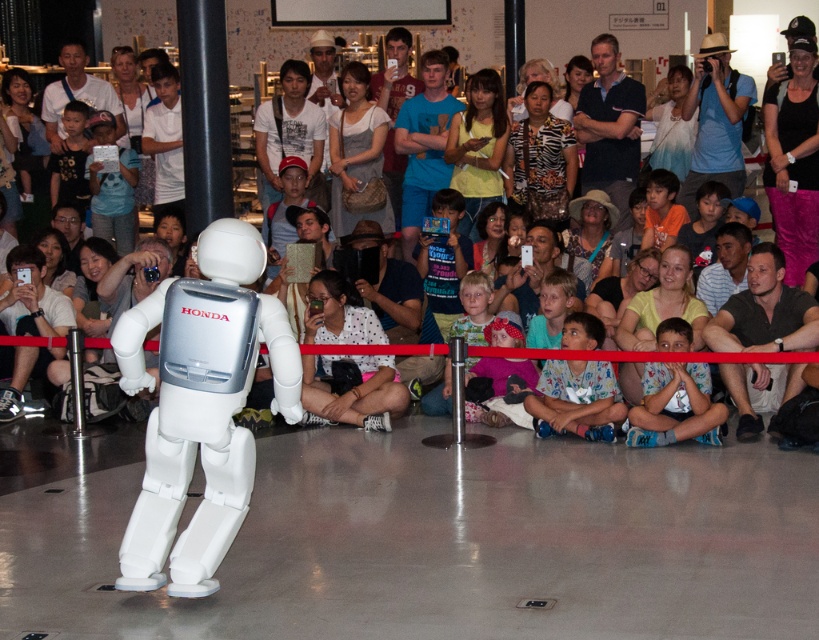
You are a photographer at the event and want to capture both the pink fabric at upper right and the white fabric hat at center in the same frame. Which object should you position closer to the edge of your camera viewfinder to include both?

To include both the pink fabric at upper right and the white fabric hat at center in the same frame, position the pink fabric at upper right closer to the edge of your camera viewfinder since it is located to the right of the white fabric hat at center.

You are a photographer at the event and need to capture the HONDA robot without any distractions. The robot is at the center of the image. There is a point marked at coordinates point (763,310) which is light brown fabric pants at lower right. Where should you position your camera to avoid including the light brown fabric pants at lower right in your shot?

To avoid including the light brown fabric pants at lower right, position your camera to the left side of the scene, ensuring the camera is aimed directly at the center where the HONDA robot is located. This will exclude the lower right area where the pants are situated.